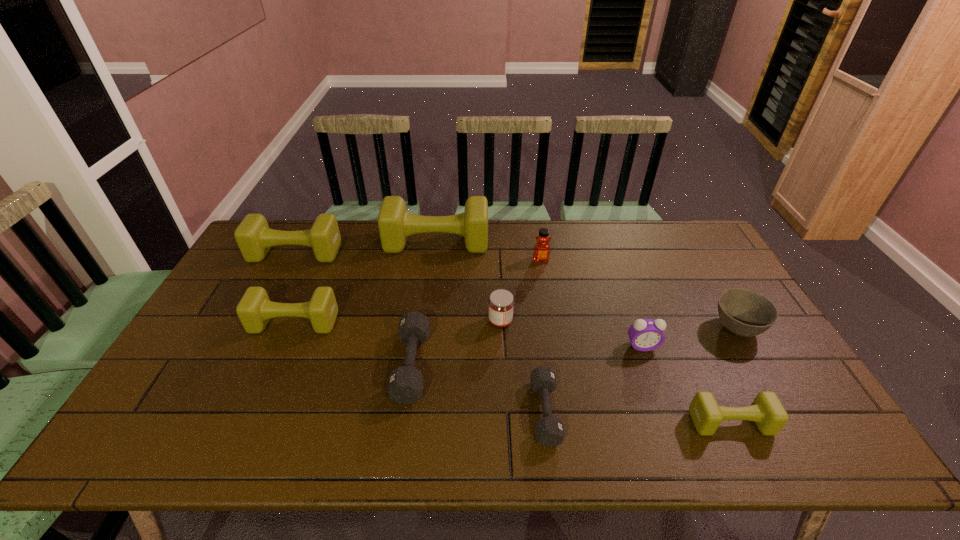
Where is `the rightmost dumbbell`? This screenshot has height=540, width=960. the rightmost dumbbell is located at coordinates (766, 410).

The height and width of the screenshot is (540, 960). I want to click on the nearest olive dumbbell, so click(766, 410).

Locate an element on the screen. the shortest object is located at coordinates (549, 430).

This screenshot has width=960, height=540. In order to click on the second dumbbell from right to left in this screenshot , I will do `click(549, 430)`.

Where is `vacant space located 0.230m on the left of the biggest olive dumbbell`? vacant space located 0.230m on the left of the biggest olive dumbbell is located at coordinates (321, 242).

Where is `free location located on the back of the second biggest olive dumbbell`? free location located on the back of the second biggest olive dumbbell is located at coordinates (311, 223).

You are a GUI agent. You are given a task and a screenshot of the screen. Output one action in this format:
    pyautogui.click(x=<x>, y=<y>)
    Task: Click on the vacant space located on the front label of the honey
    This screenshot has height=540, width=960.
    Given the screenshot: What is the action you would take?
    pyautogui.click(x=544, y=283)

Where is `free space located on the back of the third biggest olive dumbbell`? Image resolution: width=960 pixels, height=540 pixels. free space located on the back of the third biggest olive dumbbell is located at coordinates (306, 294).

This screenshot has width=960, height=540. I want to click on vacant space located on the right of the red jam, so point(644,322).

Where is `vacant area situated 0.060m on the face of the alarm clock`? vacant area situated 0.060m on the face of the alarm clock is located at coordinates (651, 370).